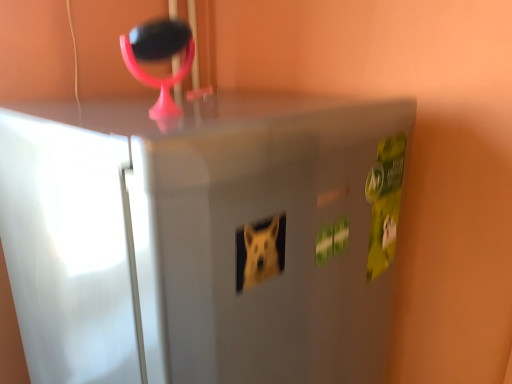
Question: In the image, is pink plastic magnifying glass at upper center positioned in front of or behind satin silver fridge at center?

Choices:
 (A) front
 (B) behind

Answer: (B)

Question: Is point (124, 59) closer or farther from the camera than point (308, 357)?

Choices:
 (A) closer
 (B) farther

Answer: (B)

Question: From a real-world perspective, is pink plastic magnifying glass at upper center positioned above or below satin silver fridge at center?

Choices:
 (A) below
 (B) above

Answer: (B)

Question: Would you say satin silver fridge at center is inside or outside pink plastic magnifying glass at upper center?

Choices:
 (A) inside
 (B) outside

Answer: (B)

Question: Based on their positions, is satin silver fridge at center located to the left or right of pink plastic magnifying glass at upper center?

Choices:
 (A) left
 (B) right

Answer: (B)

Question: Looking at the image, does satin silver fridge at center seem bigger or smaller compared to pink plastic magnifying glass at upper center?

Choices:
 (A) small
 (B) big

Answer: (B)

Question: Is point (113, 334) positioned closer to the camera than point (164, 89)?

Choices:
 (A) closer
 (B) farther

Answer: (A)